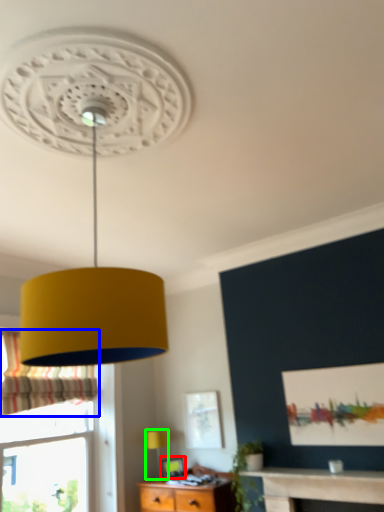
Question: Which object is positioned closest to picture frame (highlighted by a red box)? Select from curtain (highlighted by a blue box) and table lamp (highlighted by a green box).

Choices:
 (A) curtain
 (B) table lamp

Answer: (B)